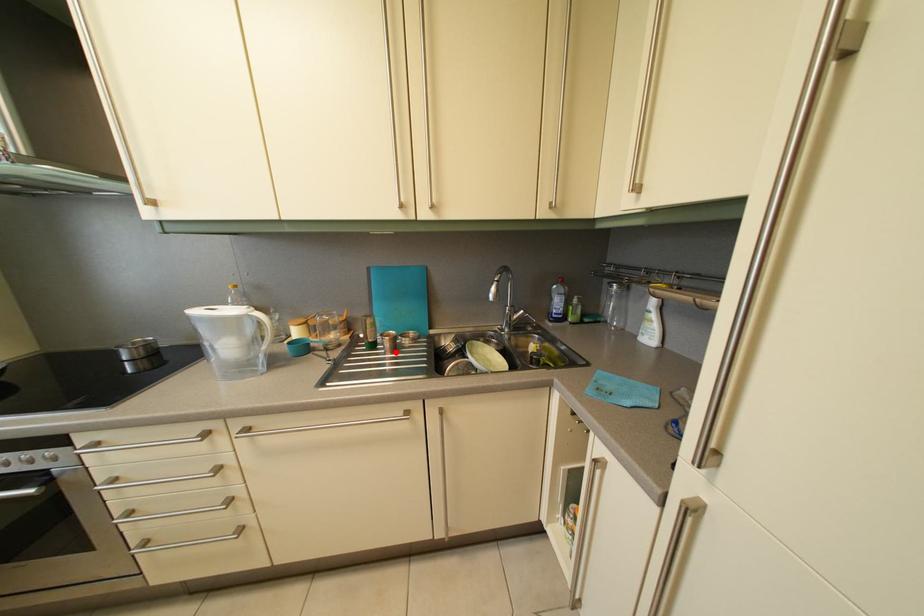
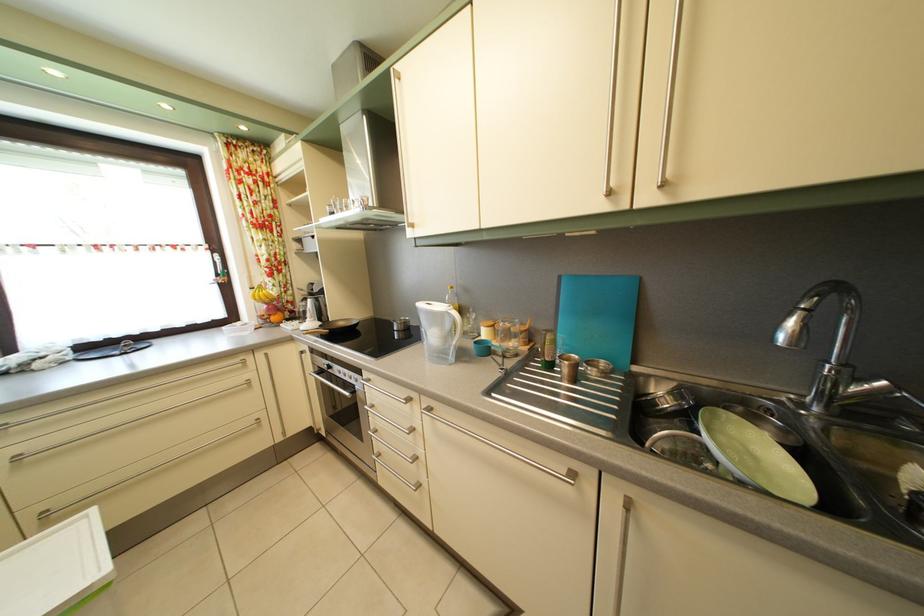
Find the pixel in the second image that matches the highlighted location in the first image.

(574, 378)